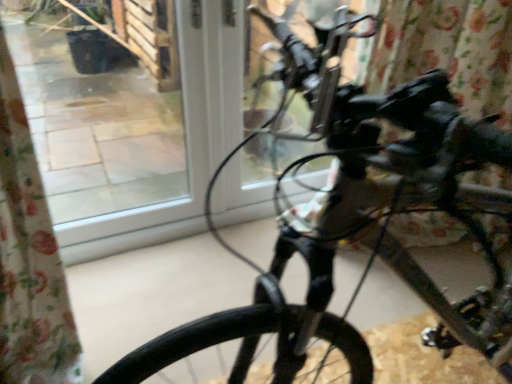
This screenshot has width=512, height=384. Identify the location of free spot to the right of transparent glass window at center. (221, 253).